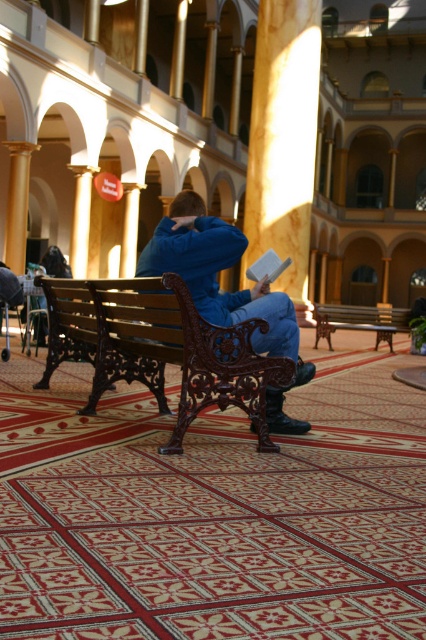
You are organizing a small display table and have both the blue fleece jacket at center and the white matte book at center. If the table has limited space, which item should you prioritize placing first to ensure both fit?

The white matte book at center should be placed first since it is narrower than the blue fleece jacket at center, allowing more space for the wider jacket afterward.

You are planning to place a 2.5 feet wide decorative mat between the polished dark wood bench at center and the smooth wooden pillar at center. Considering their widths, will the mat fit without overlapping either object?

The polished dark wood bench at center is wider than the smooth wooden pillar at center. Since the mat is 2.5 feet wide, it can fit between them as long as the combined width of the bench and pillar allows space. However, the exact placement depends on the distance between them, which isn